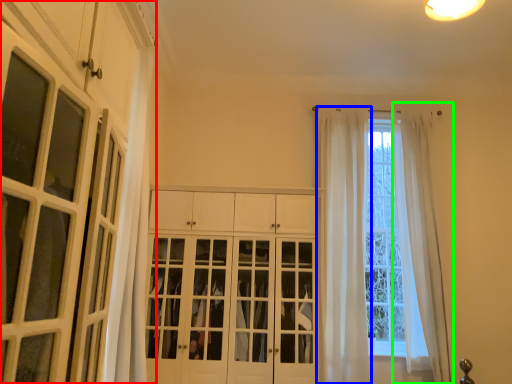
Question: Which object is positioned closest to cabinetry (highlighted by a red box)? Select from curtain (highlighted by a blue box) and curtain (highlighted by a green box).

Choices:
 (A) curtain
 (B) curtain

Answer: (A)